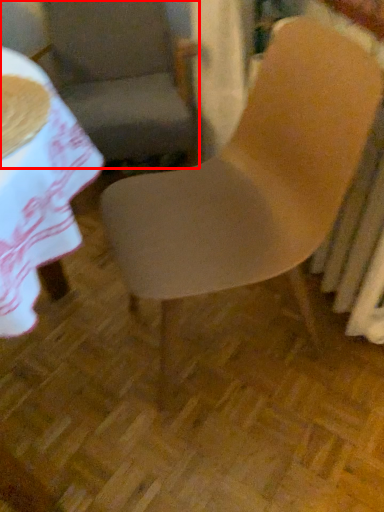
Question: From the image's perspective, what is the correct spatial positioning of chair (annotated by the red box) in reference to chair?

Choices:
 (A) below
 (B) above

Answer: (B)